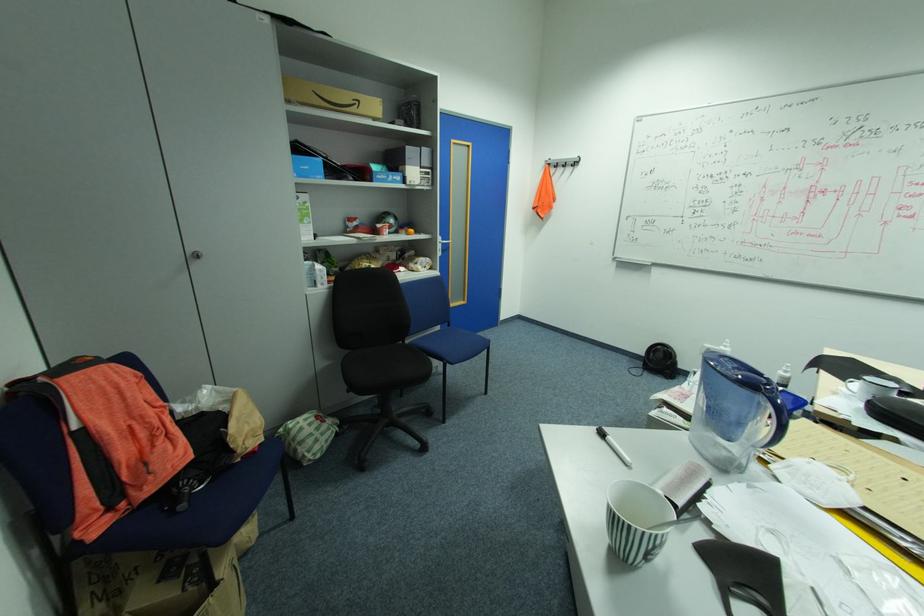
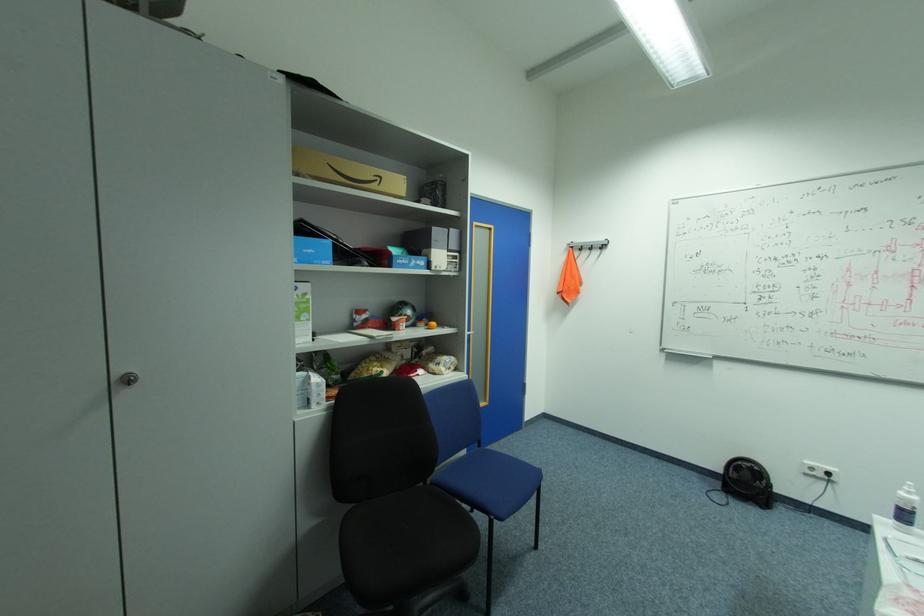
The point at (409,232) is marked in the first image. Where is the corresponding point in the second image?

(429, 323)